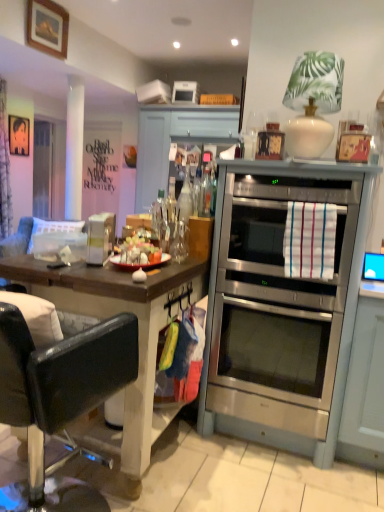
Where is `free space in front of stainless steel oven at center`? free space in front of stainless steel oven at center is located at coordinates (262, 485).